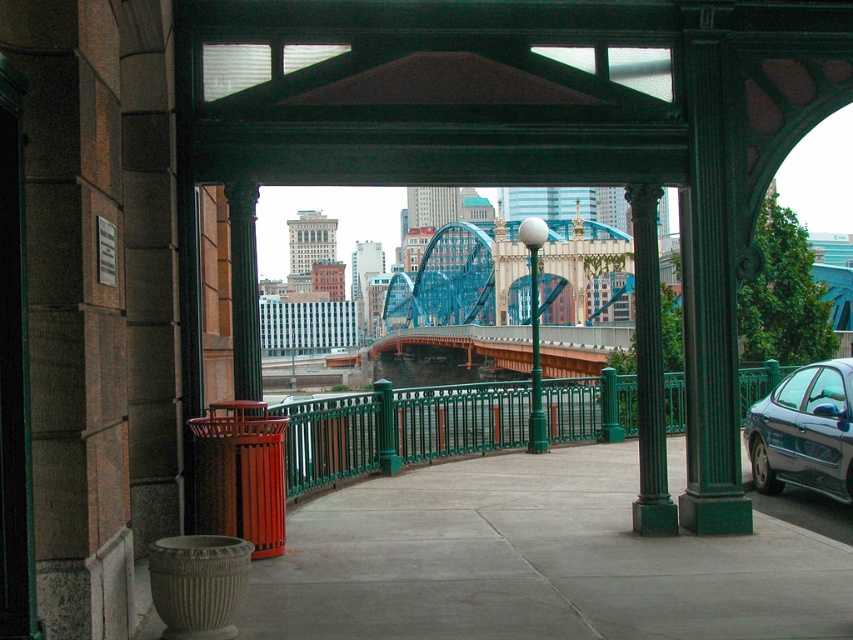
Question: Does green metal fence at center have a larger size compared to green polished metal pole at center-right?

Choices:
 (A) no
 (B) yes

Answer: (A)

Question: Which of these objects is positioned closest to the shiny dark gray sedan at right?

Choices:
 (A) gray concrete pavement at lower left
 (B) green polished metal pole at center-right
 (C) green metallic pole at center
 (D) green metal fence at center

Answer: (A)

Question: Can you confirm if shiny dark gray sedan at right is positioned above green polished metal pole at center-right?

Choices:
 (A) yes
 (B) no

Answer: (B)

Question: Which is farther from the gray concrete pavement at lower left?

Choices:
 (A) green polished metal pole at center-right
 (B) shiny dark gray sedan at right
 (C) green metal fence at center
 (D) green metallic pole at center

Answer: (D)

Question: Based on their relative distances, which object is nearer to the shiny dark gray sedan at right?

Choices:
 (A) green polished metal pole at center-right
 (B) gray concrete pavement at lower left
 (C) green metallic pole at center
 (D) green metal fence at center

Answer: (B)

Question: Can you confirm if gray concrete pavement at lower left is positioned above green metal fence at center?

Choices:
 (A) no
 (B) yes

Answer: (A)